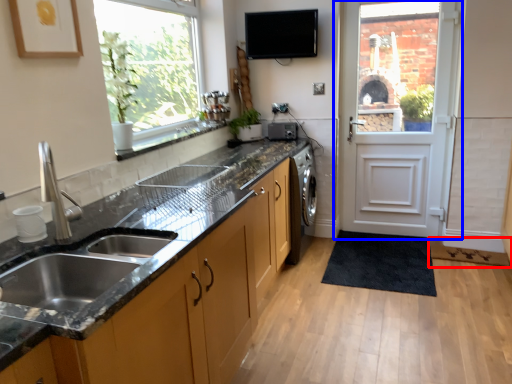
Question: Among these objects, which one is farthest to the camera, flat (highlighted by a red box) or door (highlighted by a blue box)?

Choices:
 (A) flat
 (B) door

Answer: (B)